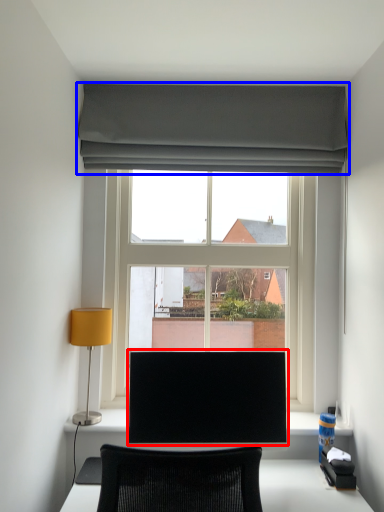
Question: Which object is closer to the camera taking this photo, computer monitor (highlighted by a red box) or curtain (highlighted by a blue box)?

Choices:
 (A) computer monitor
 (B) curtain

Answer: (A)